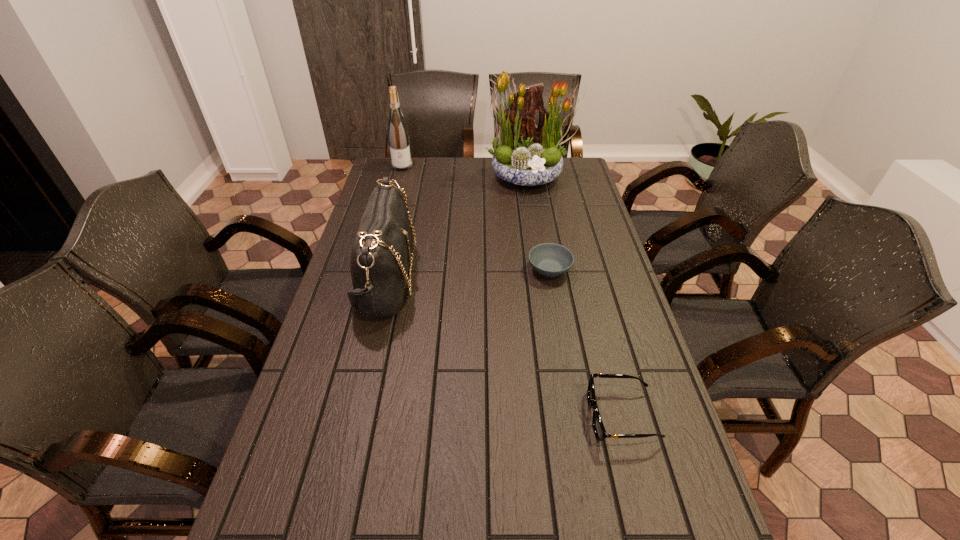
Locate an element on the screen. The width and height of the screenshot is (960, 540). flower arrangement is located at coordinates (525, 154).

At what (x,y) coordinates should I click in order to perform the action: click on wine bottle. Please return your answer as a coordinate pair (x, y). Image resolution: width=960 pixels, height=540 pixels. Looking at the image, I should click on (397, 131).

Locate an element on the screen. handbag is located at coordinates (381, 254).

Where is `the nearest object`? the nearest object is located at coordinates (598, 427).

Locate an element on the screen. soup bowl is located at coordinates (551, 260).

Image resolution: width=960 pixels, height=540 pixels. In order to click on free spot located 0.140m on the front-facing side of the tallest object in this screenshot , I will do `click(535, 214)`.

Find the location of a particular element. This screenshot has width=960, height=540. free space located on the front of the second tallest object is located at coordinates (388, 218).

Locate an element on the screen. This screenshot has height=540, width=960. vacant region located at the front of the handbag with chain and zipper is located at coordinates (461, 279).

You are a GUI agent. You are given a task and a screenshot of the screen. Output one action in this format:
    pyautogui.click(x=<x>, y=<y>)
    Task: Click on the free space located on the front-facing side of the sunglasses
    The width and height of the screenshot is (960, 540).
    Given the screenshot: What is the action you would take?
    (x=492, y=416)

Identify the location of free space located on the front-facing side of the sunglasses. Image resolution: width=960 pixels, height=540 pixels. (495, 416).